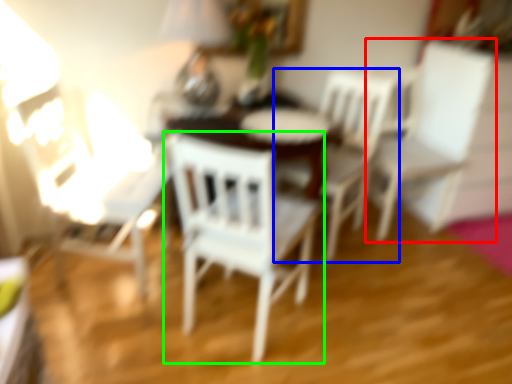
Question: Considering the real-world distances, which object is farthest from chair (highlighted by a red box)? chair (highlighted by a blue box) or chair (highlighted by a green box)?

Choices:
 (A) chair
 (B) chair

Answer: (B)